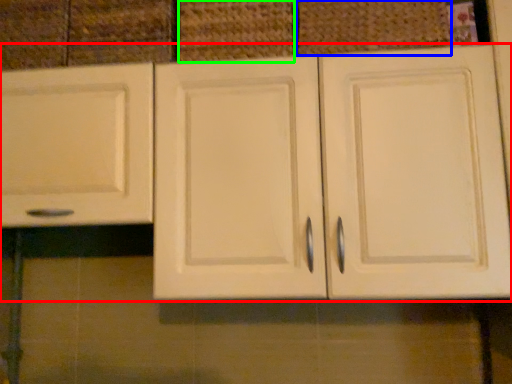
Question: Which object is the closest to the cabinetry (highlighted by a red box)? Choose among these: basket (highlighted by a blue box) or basket (highlighted by a green box).

Choices:
 (A) basket
 (B) basket

Answer: (B)